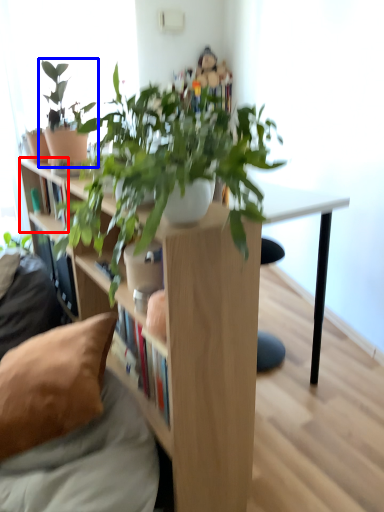
Question: Which object appears farthest to the camera in this image, shelf (highlighted by a red box) or houseplant (highlighted by a blue box)?

Choices:
 (A) shelf
 (B) houseplant

Answer: (A)